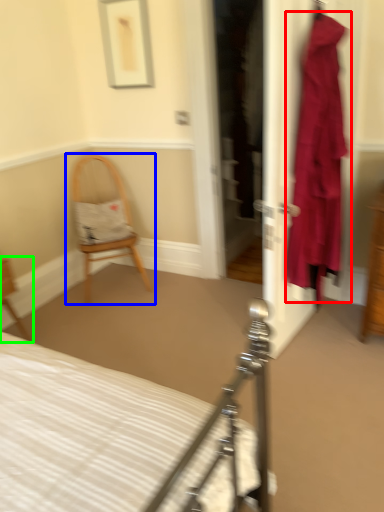
Question: Which object is the farthest from clothing (highlighted by a red box)? Choose among these: chair (highlighted by a blue box) or chair (highlighted by a green box).

Choices:
 (A) chair
 (B) chair

Answer: (B)